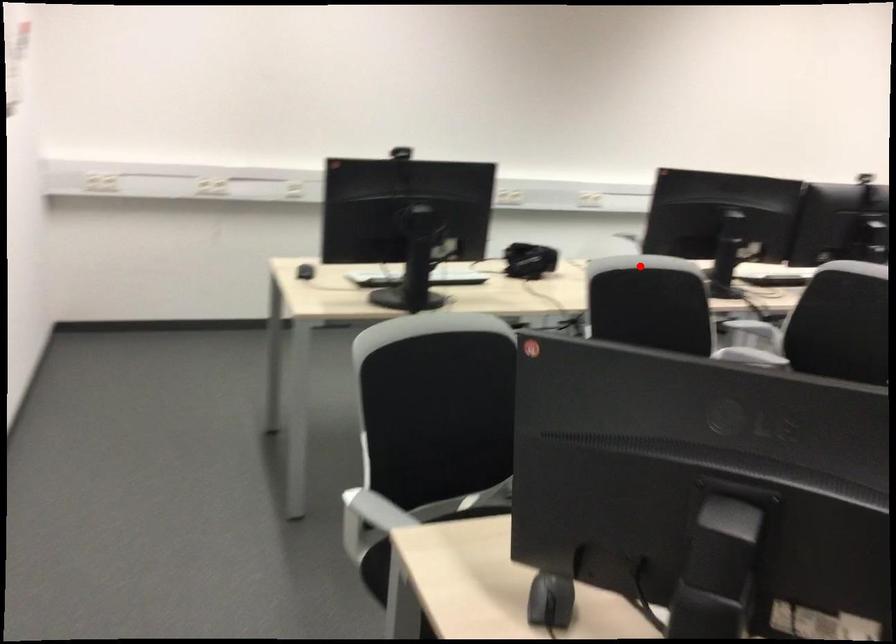
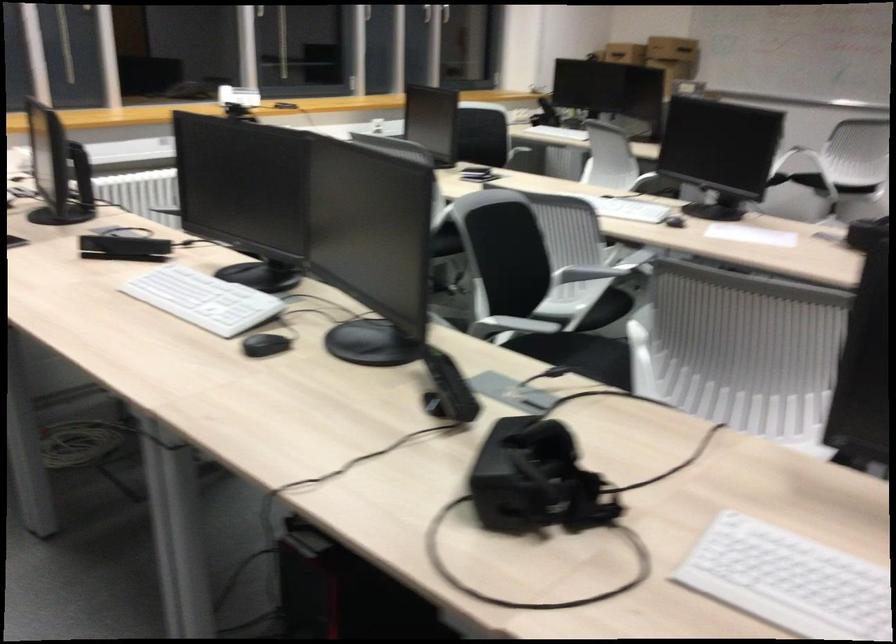
Question: I am providing you with two images of the same scene from different viewpoints. A red point is marked on the first image. Can you still see the location of the red point in image 2?

Choices:
 (A) Yes
 (B) No

Answer: (A)